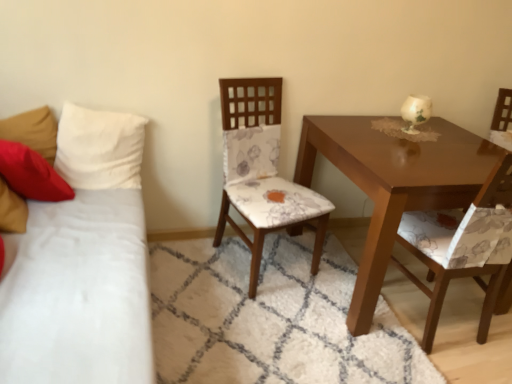
Locate an element on the screen. This screenshot has height=384, width=512. free spot in front of floral fabric chair at center, the first chair viewed from the left is located at coordinates (260, 322).